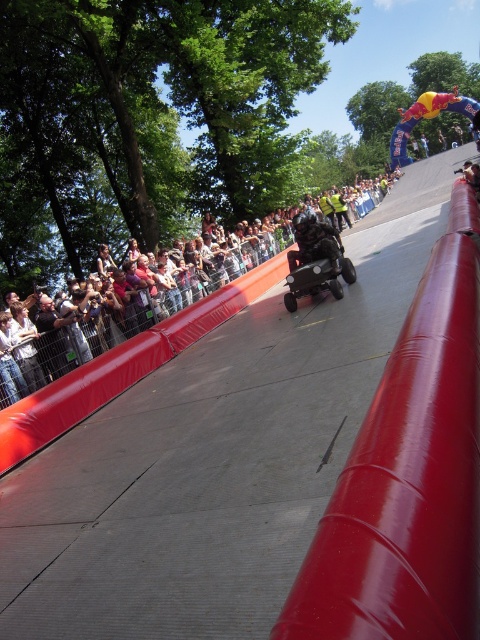
You are a safety inspector checking the safety of the ramp setup. The safety guidelines require a minimum distance of 10 meters between the rail and the crowd to ensure safety. Based on the image, is the current distance between the smooth rubber rail at center right and the matte black crowd at left compliant with the guidelines?

The distance between the smooth rubber rail at center right and the matte black crowd at left is 11.08 meters, which exceeds the required 10 meters, so it is compliant with the safety guidelines.

You are a safety inspector checking the ramp setup. The smooth rubber rail at center right is meant to protect the matte black crowd at left from any potential accidents. Based on their heights, do you think the rail provides adequate protection?

The smooth rubber rail at center right is shorter than the matte black crowd at left, so it may not provide adequate protection since the crowd is taller than the rail.

In the scene shown: You are a safety inspector checking the event setup. The smooth rubber rail at center right and the matte black crowd at left are both present. Which object is smaller in size?

The smooth rubber rail at center right has a smaller size compared to the matte black crowd at left.